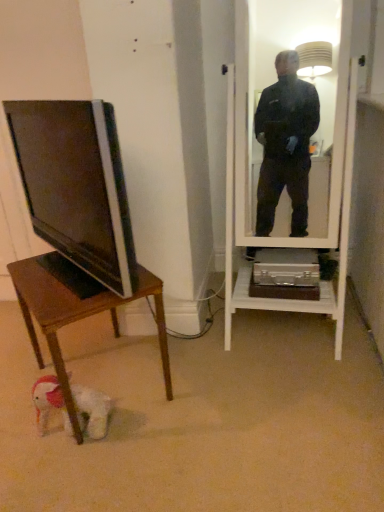
Identify the location of vacant space in wooden desk at lower left (from a real-world perspective). [118, 375].